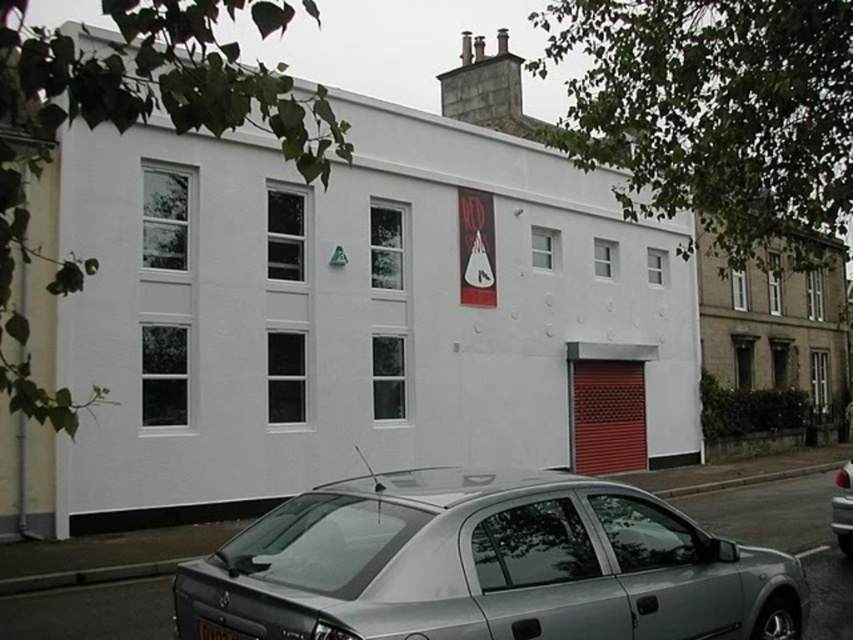
Question: Which object appears closest to the camera in this image?

Choices:
 (A) satin silver sedan at lower center
 (B) silver metallic car at lower right
 (C) black plastic license plate at lower center

Answer: (A)

Question: Which object is closer to the camera taking this photo?

Choices:
 (A) black plastic license plate at lower center
 (B) satin silver sedan at lower center

Answer: (B)

Question: Observing the image, what is the correct spatial positioning of satin silver sedan at lower center in reference to silver metallic car at lower right?

Choices:
 (A) above
 (B) below

Answer: (A)

Question: Does satin silver sedan at lower center appear on the right side of black plastic license plate at lower center?

Choices:
 (A) no
 (B) yes

Answer: (B)

Question: Which of the following is the closest to the observer?

Choices:
 (A) (199, 620)
 (B) (314, 518)

Answer: (A)

Question: Does silver metallic car at lower right have a greater width compared to black plastic license plate at lower center?

Choices:
 (A) yes
 (B) no

Answer: (A)